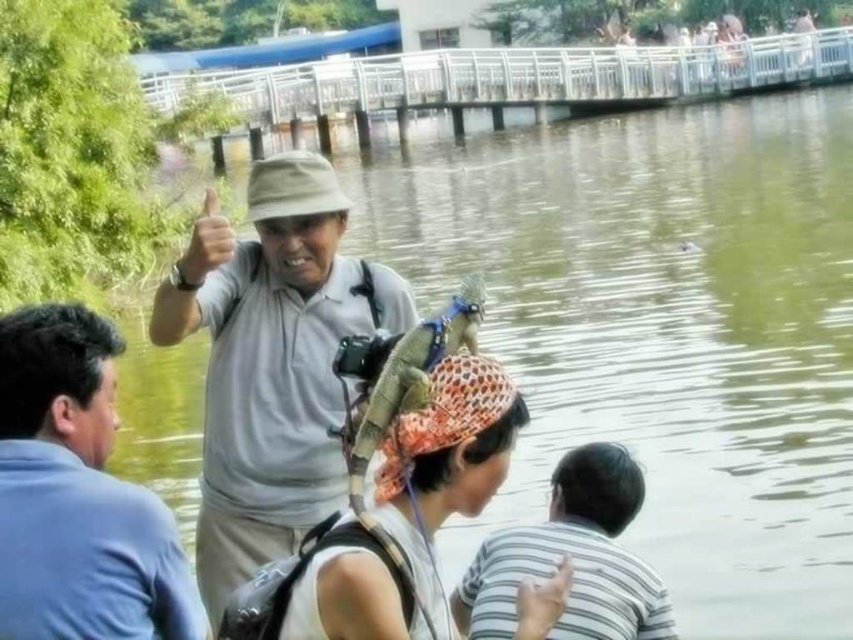
Question: Which of the following is the farthest from the observer?

Choices:
 (A) striped cotton shirt at lower right
 (B) leather-like headscarf at center
 (C) blue shirt at left
 (D) matte gray shirt at center

Answer: (D)

Question: Is blue shirt at left thinner than leather-like headscarf at center?

Choices:
 (A) no
 (B) yes

Answer: (A)

Question: Is matte gray shirt at center positioned behind blue shirt at left?

Choices:
 (A) no
 (B) yes

Answer: (B)

Question: Which point is closer to the camera?

Choices:
 (A) (28, 460)
 (B) (498, 403)

Answer: (A)

Question: Which point is farther to the camera?

Choices:
 (A) leather-like headscarf at center
 (B) blue shirt at left
 (C) striped cotton shirt at lower right
 (D) matte gray shirt at center

Answer: (D)

Question: Is blue shirt at left further to the viewer compared to leather-like headscarf at center?

Choices:
 (A) yes
 (B) no

Answer: (B)